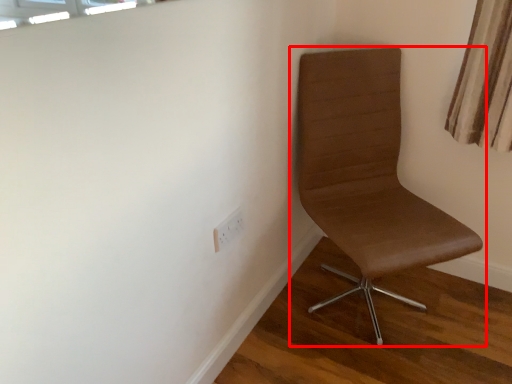
Question: From the image's perspective, considering the relative positions of chair (annotated by the red box) and electric outlet in the image provided, where is chair (annotated by the red box) located with respect to the staircase?

Choices:
 (A) above
 (B) below

Answer: (A)